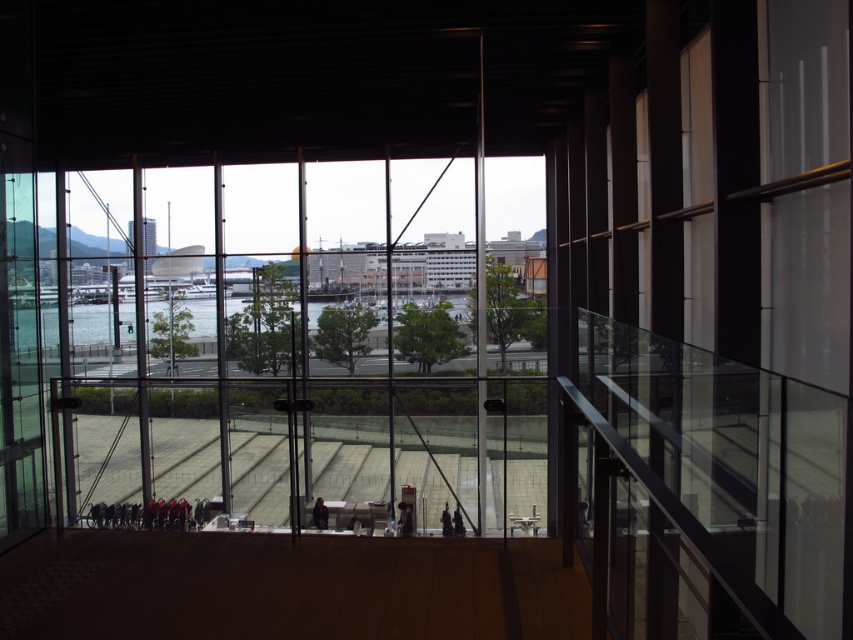
You are standing in the modern architectural space and want to look out the transparent glass window at center. However, there is an obstacle blocking your view of the clear water at center. Which object from the scene might be in the way?

The transparent glass window at center is to the right of clear water at center, so the window is blocking your view of the clear water at center.

You are a window cleaner standing on the balcony. You need to clean both the transparent glass window at center and the clear water at center. Which object requires you to work at a higher elevation?

The transparent glass window at center requires working at a higher elevation because it is much taller than the clear water at center.

You are standing in the interior space and want to look out towards the waterfront. Which object between the transparent glass window at center and the clear water at center would allow you to see the harbor boats more clearly?

The transparent glass window at center is closer to the viewer than the clear water at center, so the transparent glass window at center would provide a clearer view of the harbor boats.